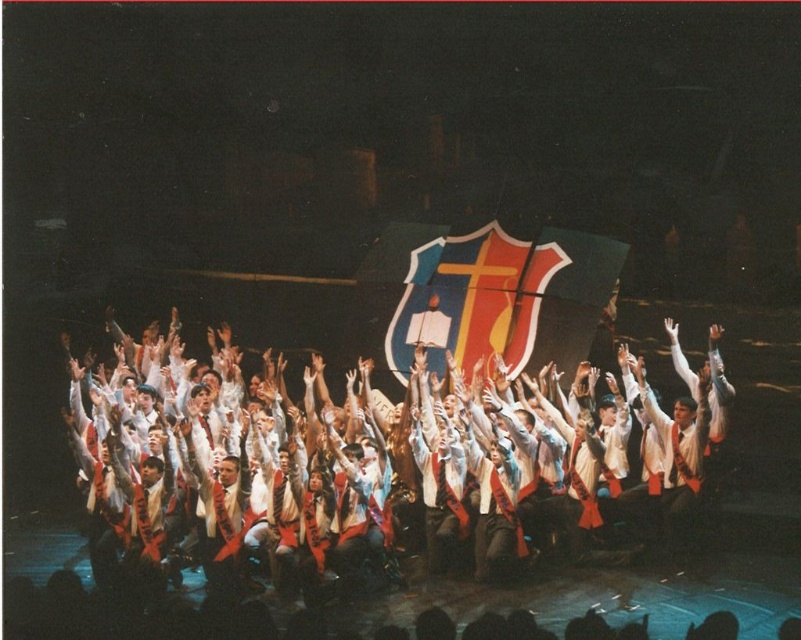
You are a photographer positioned at the front of the stage. You want to capture a closeup of the white fabric shirt at center. Based on its 2D location coordinates, which direction should you move your camera to focus on it?

The white fabric shirt at center is located at coordinates point (228, 476). Since the x coordinate is 0.744, which is closer to the right side of the frame, and the y coordinate is 0.287, closer to the bottom, you should move your camera slightly to the right and down to focus on the white fabric shirt at center.

You are a photographer taking a picture of the stage. You notice two points marked on the stage floor at coordinates point (x=117, y=492) and point (x=574, y=358). If you want to focus on the point that is closer to your camera, which coordinate should you choose?

You should focus on point (x=117, y=492) because it is closer to the camera than point (x=574, y=358).